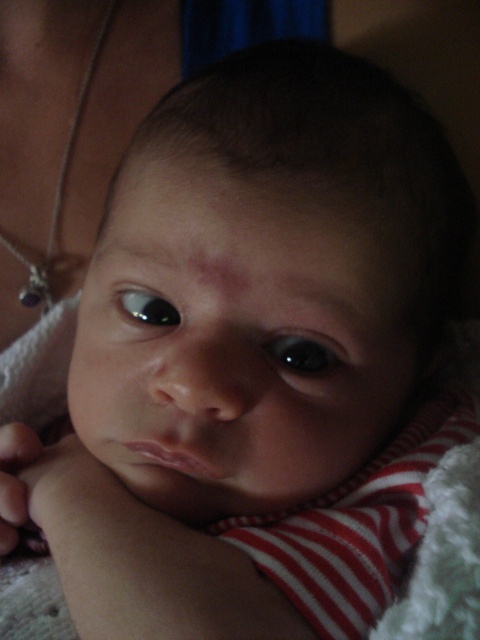
You are a photographer adjusting the focus on your camera. You notice two eyes in the image, the black glossy eye at center and the glossy black eye at center. Which eye appears taller in the photo?

The black glossy eye at center appears much taller than the glossy black eye at center in the photo.